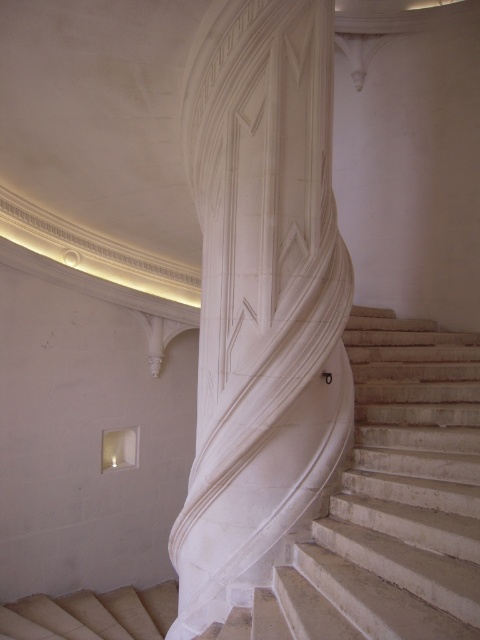
Consider the image. You are an architect designing a new building and need to ensure that the white marble pillar at center and beige textured stairs at lower left meet specific spatial requirements. Which object is taller?

The white marble pillar at center is taller than the beige textured stairs at lower left according to the description.